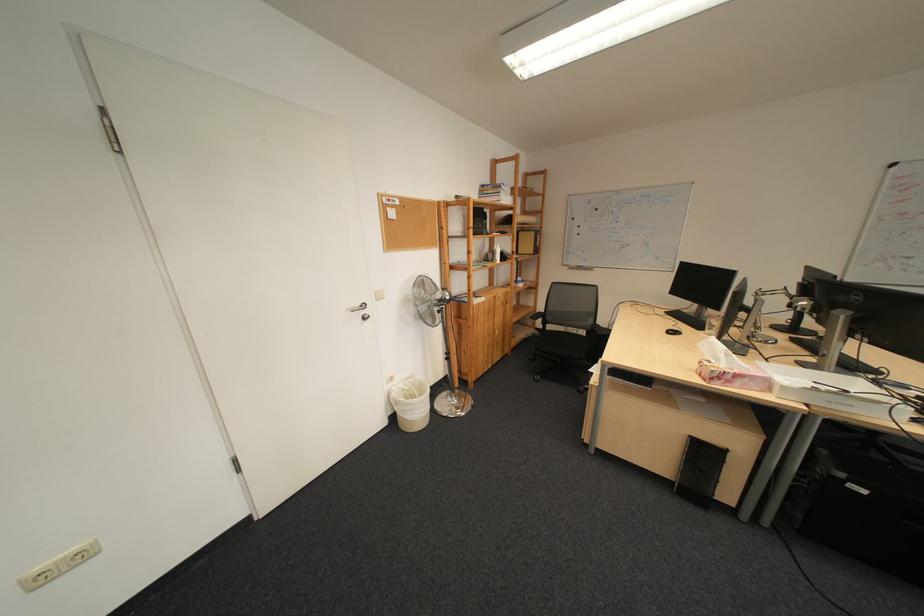
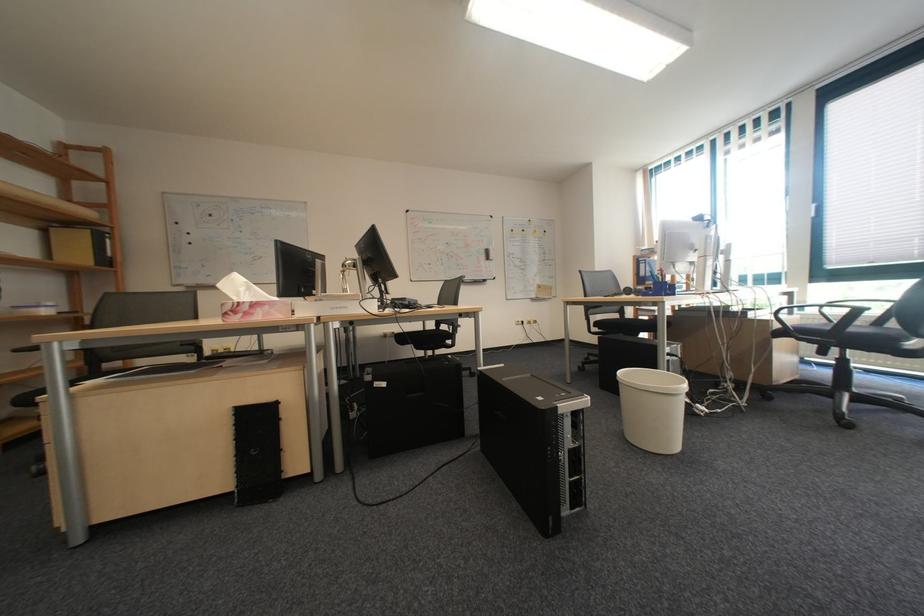
Find the pixel in the second image that matches pixel 754 382 in the first image.

(273, 312)